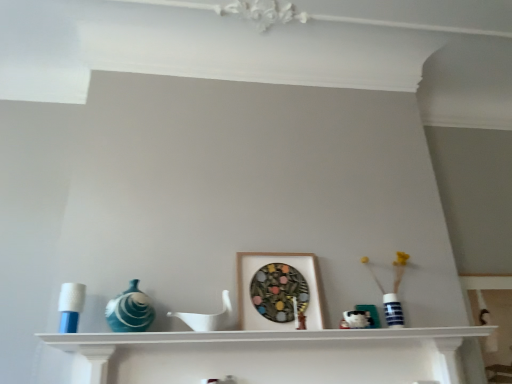
This screenshot has width=512, height=384. What are the coordinates of `blue plastic candle holder at left` in the screenshot? It's located at (71, 306).

What do you see at coordinates (393, 291) in the screenshot? The width and height of the screenshot is (512, 384). I see `blue striped vase at right` at bounding box center [393, 291].

This screenshot has width=512, height=384. In order to click on blue striped vase at right in this screenshot , I will do `click(393, 291)`.

Locate an element on the screen. The image size is (512, 384). matte blue glass vase at left is located at coordinates (130, 310).

This screenshot has width=512, height=384. Find the location of `art below the blue striped vase at right (from a real-world perspective)`. art below the blue striped vase at right (from a real-world perspective) is located at coordinates (356, 319).

Is blue striped vase at right wider than white glossy ceramic mug at center?

Yes.

Is blue striped vase at right next to white glossy ceramic mug at center?

There is a gap between blue striped vase at right and white glossy ceramic mug at center.

Is blue striped vase at right to the left of white glossy ceramic mug at center from the viewer's perspective?

In fact, blue striped vase at right is to the right of white glossy ceramic mug at center.

Is point (63, 329) closer to camera compared to point (138, 321)?

Yes.

Does blue plastic candle holder at left turn towards matte blue glass vase at left?

No, blue plastic candle holder at left is not facing towards matte blue glass vase at left.

Do you think blue plastic candle holder at left is within matte blue glass vase at left, or outside of it?

blue plastic candle holder at left cannot be found inside matte blue glass vase at left.

From a real-world perspective, is blue plastic candle holder at left positioned above or below matte blue glass vase at left?

blue plastic candle holder at left is below matte blue glass vase at left.

Is blue plastic candle holder at left completely or partially outside of blue striped vase at right?

That's correct, blue plastic candle holder at left is outside of blue striped vase at right.

Looking at the image, does blue plastic candle holder at left seem bigger or smaller compared to blue striped vase at right?

Considering their sizes, blue plastic candle holder at left takes up less space than blue striped vase at right.

Is blue plastic candle holder at left in contact with blue striped vase at right?

blue plastic candle holder at left and blue striped vase at right are not in contact.

From a real-world perspective, is blue plastic candle holder at left on blue striped vase at right?

No, from a real-world perspective, blue plastic candle holder at left is not over blue striped vase at right

Based on their sizes in the image, would you say white matte shelf at center is bigger or smaller than blue striped vase at right?

In the image, white matte shelf at center appears to be larger than blue striped vase at right.

From a real-world perspective, is white matte shelf at center located higher than blue striped vase at right?

No, from a real-world perspective, white matte shelf at center is not over blue striped vase at right

Considering the sizes of objects wooden picture frame at center and white matte shelf at center in the image provided, who is wider, wooden picture frame at center or white matte shelf at center?

With larger width is white matte shelf at center.

Is wooden picture frame at center beside white matte shelf at center?

No, wooden picture frame at center is not next to white matte shelf at center.

From a real-world perspective, does wooden picture frame at center stand above white matte shelf at center?

Correct, in the physical world, wooden picture frame at center is higher than white matte shelf at center.

Between wooden picture frame at center and white matte shelf at center, which one appears on the left side from the viewer's perspective?

Positioned to the left is white matte shelf at center.

From a real-world perspective, which object rests below the other?

white matte shelf at center, from a real-world perspective.

Which point is more distant from viewer, (354,333) or (61,319)?

The point (354,333) is farther.

Can you confirm if white matte shelf at center is bigger than blue plastic candle holder at left?

Indeed, white matte shelf at center has a larger size compared to blue plastic candle holder at left.

How far apart are white glossy ceramic mug at center and white matte shelf at center?

A distance of 14.38 inches exists between white glossy ceramic mug at center and white matte shelf at center.

From the image's perspective, is white glossy ceramic mug at center positioned above or below white matte shelf at center?

From the image's perspective, white glossy ceramic mug at center appears above white matte shelf at center.

From a real-world perspective, is white glossy ceramic mug at center positioned above or below white matte shelf at center?

white glossy ceramic mug at center is situated higher than white matte shelf at center in the real world.

Choose the correct answer: Is white glossy ceramic mug at center inside white matte shelf at center or outside it?

white glossy ceramic mug at center is outside white matte shelf at center.

This screenshot has width=512, height=384. I want to click on art below the blue striped vase at right (from the image's perspective), so click(x=356, y=319).

Find the location of a particular element. This screenshot has height=384, width=512. candle holder that appears on the left of matte blue glass vase at left is located at coordinates (71, 306).

From the image, which object appears to be nearer to white matte shelf at center, blue striped vase at right or matte blue glass vase at left?

matte blue glass vase at left lies closer to white matte shelf at center than the other object.

Considering their positions, is blue plastic candle holder at left positioned closer to matte blue glass vase at left than white glossy ceramic mug at center?

blue plastic candle holder at left is positioned closer to the anchor matte blue glass vase at left.

Considering their positions, is matte blue glass vase at left positioned closer to white glossy ceramic mug at center than blue plastic candle holder at left?

Based on the image, matte blue glass vase at left appears to be nearer to white glossy ceramic mug at center.

Which object lies further to the anchor point white glossy ceramic mug at center, wooden picture frame at center or blue plastic candle holder at left?

blue plastic candle holder at left is further to white glossy ceramic mug at center.

Which object lies further to the anchor point blue plastic candle holder at left, blue striped vase at right or white matte shelf at center?

Based on the image, blue striped vase at right appears to be further to blue plastic candle holder at left.

Looking at the image, which one is located closer to blue striped vase at right, wooden picture frame at center or blue plastic candle holder at left?

wooden picture frame at center.

Based on their spatial positions, is white glossy ceramic mug at center or white matte shelf at center further from matte blue glass vase at left?

white glossy ceramic mug at center lies further to matte blue glass vase at left than the other object.

Considering their positions, is blue plastic candle holder at left positioned closer to blue striped vase at right than wooden picture frame at center?

wooden picture frame at center lies closer to blue striped vase at right than the other object.

The width and height of the screenshot is (512, 384). What are the coordinates of `picture frame situated between white matte shelf at center and white glossy ceramic mug at center from left to right` in the screenshot? It's located at (269, 263).

Where is `shelf located between blue plastic candle holder at left and white glossy ceramic mug at center in the left-right direction`? Image resolution: width=512 pixels, height=384 pixels. shelf located between blue plastic candle holder at left and white glossy ceramic mug at center in the left-right direction is located at coordinates (264, 335).

In order to click on art located between wooden picture frame at center and blue striped vase at right in the left-right direction in this screenshot , I will do `click(356, 319)`.

Locate an element on the screen. art between matte blue glass vase at left and blue striped vase at right from left to right is located at coordinates point(356,319).